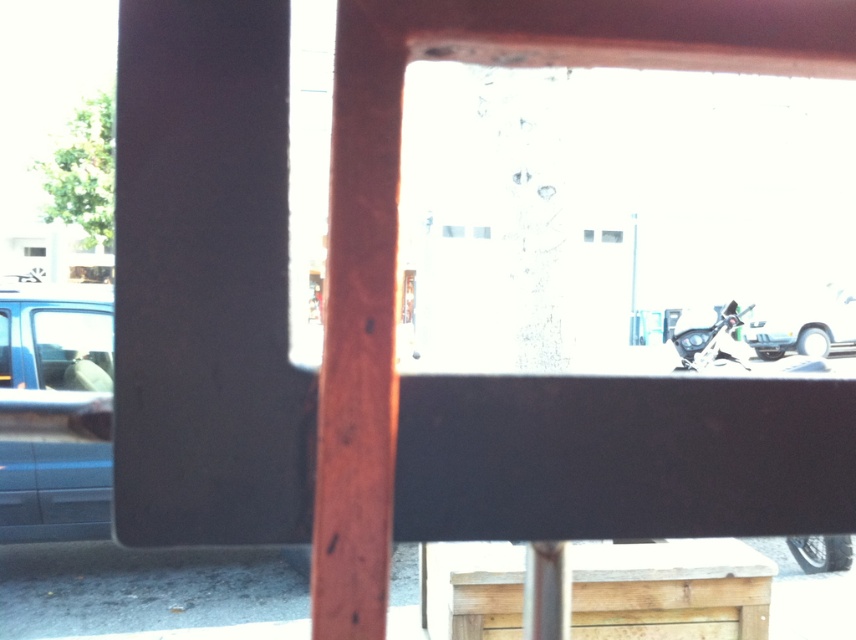
Question: Can you confirm if shiny black motorcycle at lower right is bigger than shiny metallic motorcycle at lower right?

Choices:
 (A) yes
 (B) no

Answer: (A)

Question: Which of the following is the closest to the observer?

Choices:
 (A) shiny black motorcycle at lower right
 (B) shiny silver car at right
 (C) shiny metallic motorcycle at lower right
 (D) matte blue van at left

Answer: (A)

Question: Does matte blue van at left come in front of shiny silver car at right?

Choices:
 (A) no
 (B) yes

Answer: (B)

Question: Which point is closer to the camera?

Choices:
 (A) matte blue van at left
 (B) shiny metallic motorcycle at lower right
 (C) shiny black motorcycle at lower right

Answer: (C)

Question: Can you confirm if shiny black motorcycle at lower right is positioned below shiny metallic motorcycle at lower right?

Choices:
 (A) yes
 (B) no

Answer: (A)

Question: Which point is farther to the camera?

Choices:
 (A) (43, 496)
 (B) (746, 356)
 (C) (698, 348)

Answer: (C)